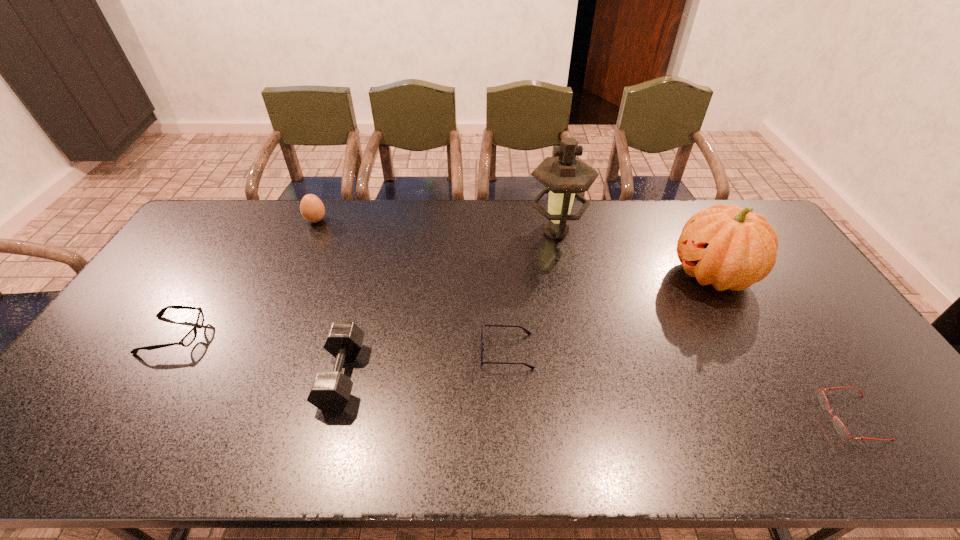
Locate an element on the screen. the shortest spectacles is located at coordinates (838, 425).

In order to click on vacant space situated 0.210m on the right of the fifth object from left to right in this screenshot , I will do `click(646, 232)`.

Identify the location of vacant space situated on the carved face of the pumpkin. (624, 274).

In order to click on vacant space situated 0.060m on the carved face of the pumpkin in this screenshot , I will do [x=653, y=274].

I want to click on free space located on the carved face of the pumpkin, so click(562, 274).

The image size is (960, 540). I want to click on vacant region located 0.080m on the left of the fifth shortest object, so click(283, 220).

At what (x,y) coordinates should I click in order to perform the action: click on vacant space located 0.360m on the back of the fifth object from right to left. Please return your answer as a coordinate pair (x, y). Looking at the image, I should click on (372, 257).

You are a GUI agent. You are given a task and a screenshot of the screen. Output one action in this format:
    pyautogui.click(x=<x>, y=<y>)
    Task: Click on the vacant point located on the front-facing side of the fourth object from right to left
    This screenshot has width=960, height=540.
    Given the screenshot: What is the action you would take?
    coord(396,352)

Where is `vacant space located on the front-facing side of the fourth object from right to left`? The width and height of the screenshot is (960, 540). vacant space located on the front-facing side of the fourth object from right to left is located at coordinates point(418,352).

Locate an element on the screen. This screenshot has height=540, width=960. vacant space located on the front-facing side of the fourth object from right to left is located at coordinates (340, 352).